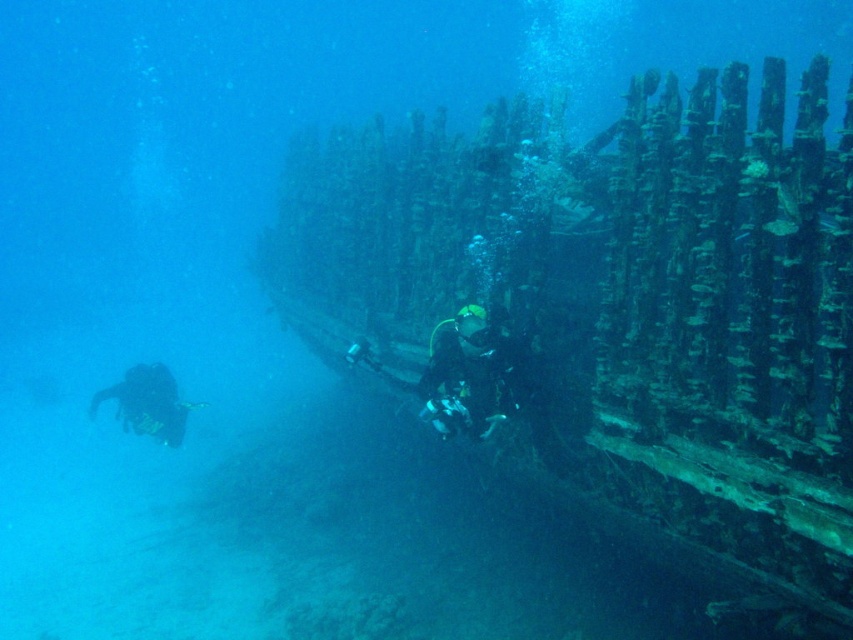
Question: Can you confirm if black matte diving suit at center is smaller than black scuba diver at lower left?

Choices:
 (A) no
 (B) yes

Answer: (B)

Question: Does black matte diving suit at center appear on the right side of black scuba diver at lower left?

Choices:
 (A) no
 (B) yes

Answer: (B)

Question: Which point appears farthest from the camera in this image?

Choices:
 (A) (143, 385)
 (B) (488, 337)

Answer: (A)

Question: Which of the following is the closest to the observer?

Choices:
 (A) black matte diving suit at center
 (B) black scuba diver at lower left

Answer: (A)

Question: Does black matte diving suit at center appear on the left side of black scuba diver at lower left?

Choices:
 (A) yes
 (B) no

Answer: (B)